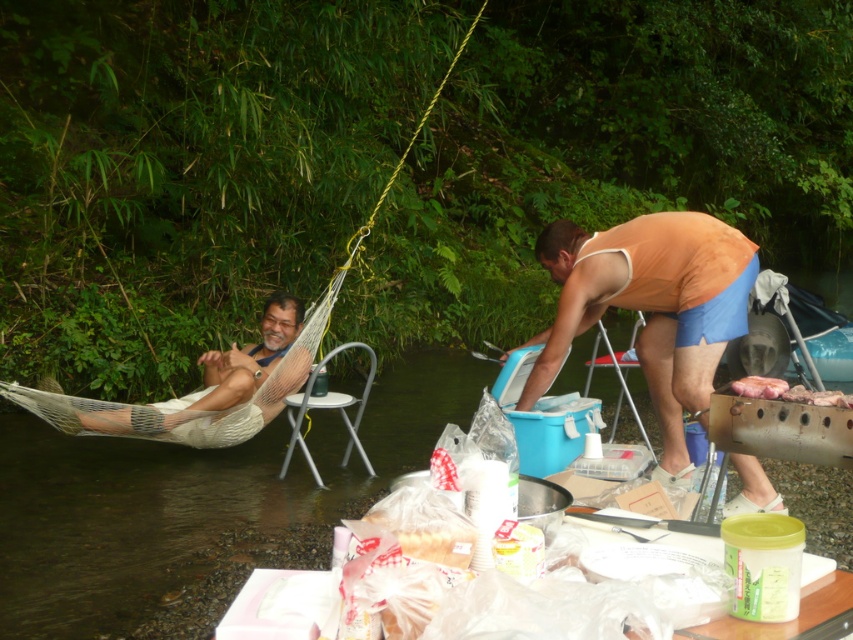
Question: Which point appears farthest from the camera in this image?

Choices:
 (A) tap(666, 323)
 (B) tap(186, 403)
 (C) tap(637, 426)

Answer: (C)

Question: Observing the image, what is the correct spatial positioning of white mesh hammock at left in reference to white metallic chair at center?

Choices:
 (A) left
 (B) right

Answer: (A)

Question: Which object appears farthest from the camera in this image?

Choices:
 (A) white mesh hammock at left
 (B) white metallic chair at center
 (C) orange fabric tank top at right

Answer: (A)

Question: Which point is farther to the camera?

Choices:
 (A) 370,364
 (B) 607,353

Answer: (B)

Question: Can you confirm if orange fabric tank top at right is positioned below raw meat at right?

Choices:
 (A) yes
 (B) no

Answer: (B)

Question: Does raw meat at right lie behind blue plastic chair at lower right?

Choices:
 (A) no
 (B) yes

Answer: (A)